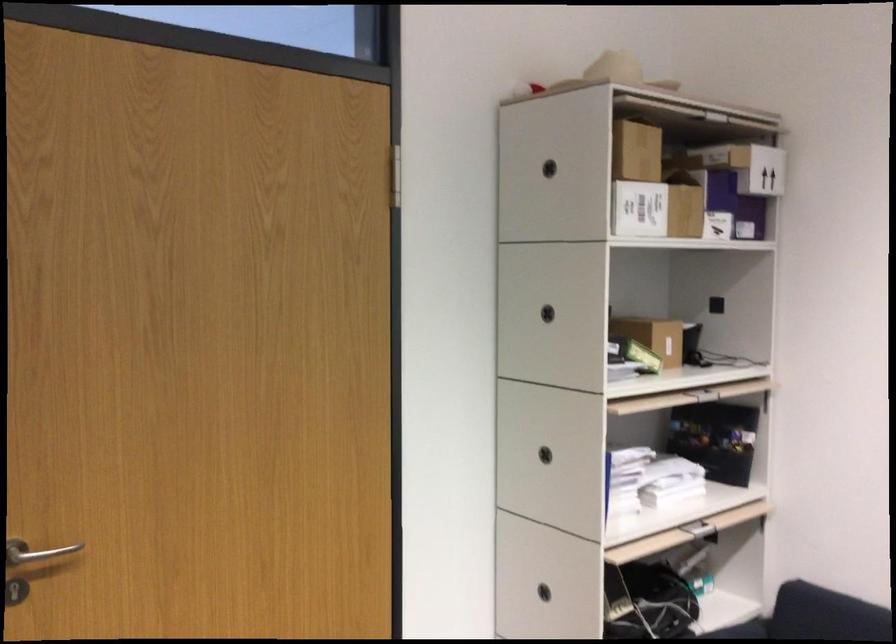
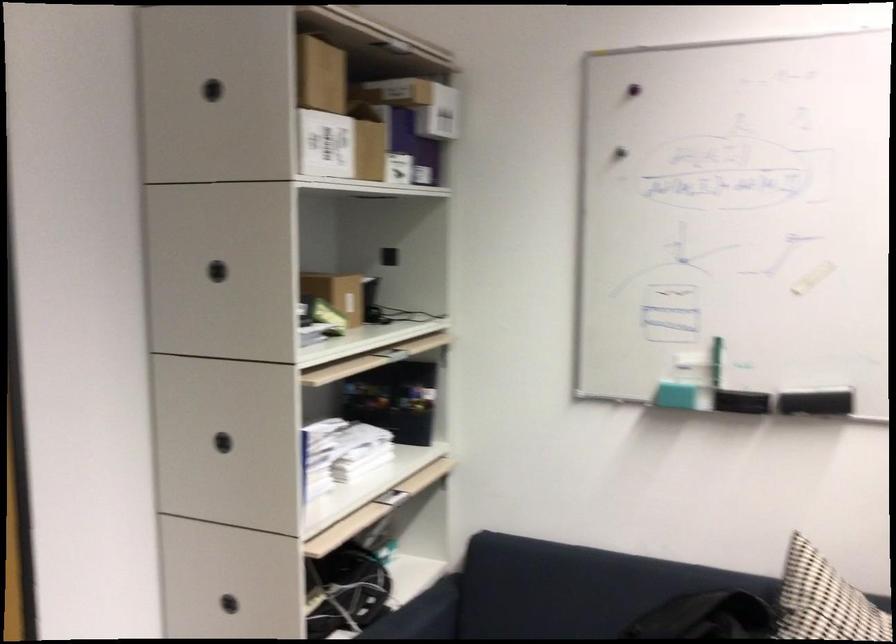
The point at [655,205] is marked in the first image. Where is the corresponding point in the second image?

(340, 146)